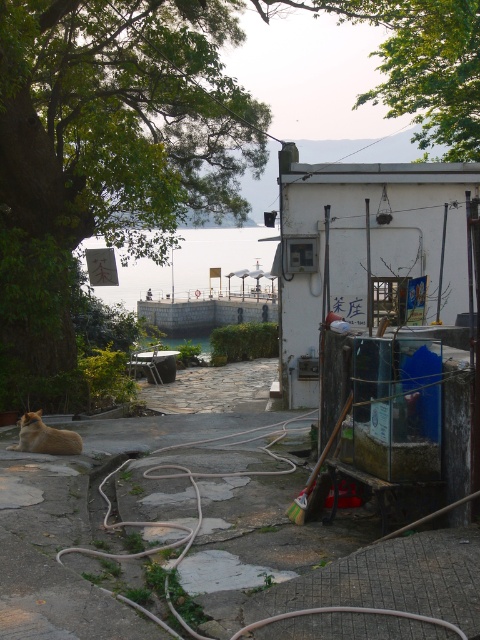
Is white rubber garden hose at lower center shorter than golden fur cat at lower left?

Yes.

Which of these two, white rubber garden hose at lower center or golden fur cat at lower left, stands taller?

With more height is golden fur cat at lower left.

The width and height of the screenshot is (480, 640). Describe the element at coordinates (173, 522) in the screenshot. I see `white rubber garden hose at lower center` at that location.

The height and width of the screenshot is (640, 480). What are the coordinates of `white rubber garden hose at lower center` in the screenshot? It's located at (173, 522).

Who is more forward, (x=12, y=147) or (x=241, y=442)?

Point (x=241, y=442) is more forward.

Does green leafy tree at upper left lie in front of white rubber garden hose at lower center?

That is False.

Is point (33, 4) farther from viewer compared to point (206, 472)?

Yes, point (33, 4) is farther from viewer.

This screenshot has height=640, width=480. I want to click on green leafy tree at upper left, so click(x=106, y=154).

Is green leafy tree at upper left wider than golden fur cat at lower left?

Correct, the width of green leafy tree at upper left exceeds that of golden fur cat at lower left.

The height and width of the screenshot is (640, 480). I want to click on green leafy tree at upper left, so click(x=106, y=154).